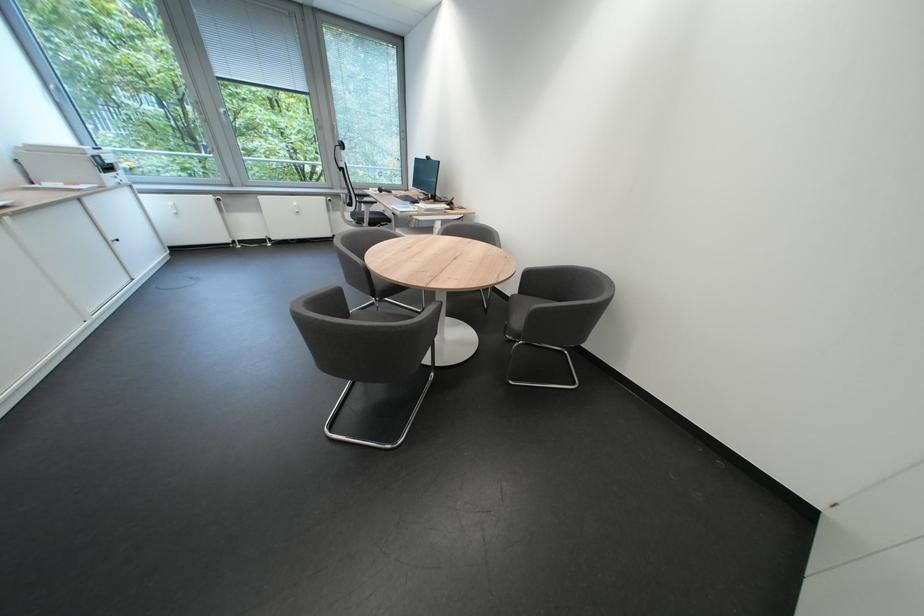
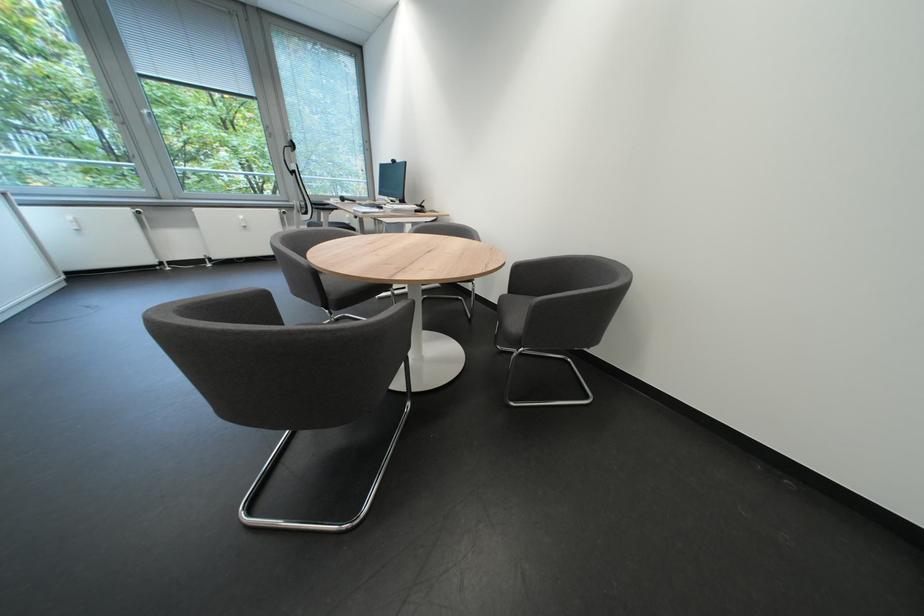
Question: The first image is from the beginning of the video and the second image is from the end. How did the camera likely rotate when shooting the video?

Choices:
 (A) Left
 (B) Right
 (C) Up
 (D) Down

Answer: (B)